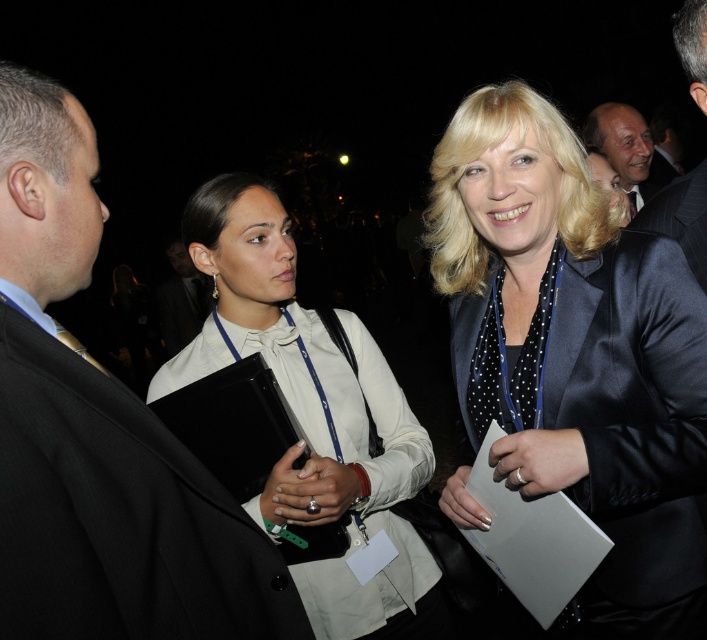
You are a photographer at the event and want to capture a photo that includes both the white satin blouse at center and the dark suit jacket at upper right. Based on their positions, which object should you focus on first to ensure both are in frame?

The white satin blouse at center is below dark suit jacket at upper right, so you should focus on the dark suit jacket at upper right first to ensure both are in frame.

You are a photographer adjusting your camera settings to focus on two specific points in the image. The first point is at coordinate point(399, 556) and the second is at point(653, 170). Which point should you focus on first if you want to ensure the closest object is in sharp focus?

You should focus on point(399, 556) first because it is closer to the camera than point(653, 170), ensuring the closest object is in sharp focus.